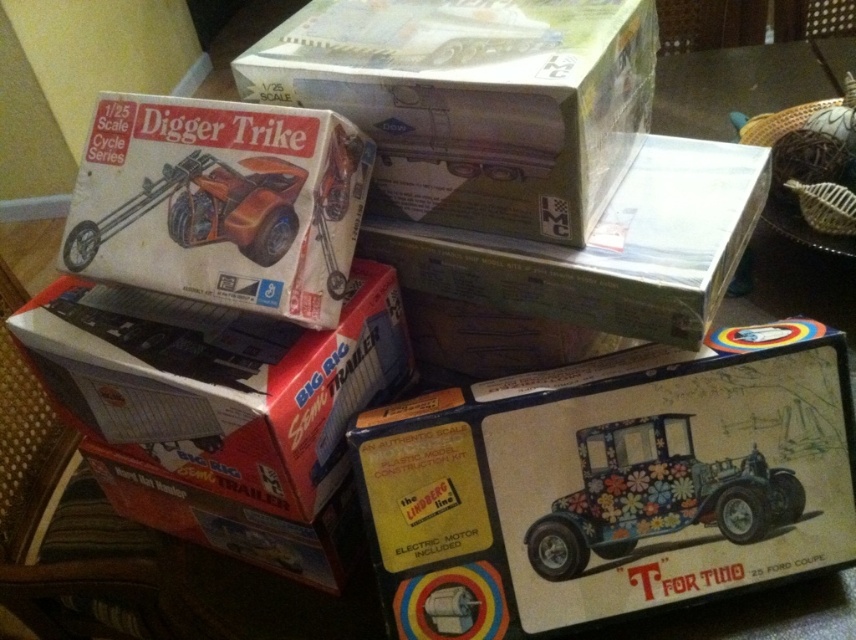
Does point (522, 556) come in front of point (449, 605)?

No, it is behind (449, 605).

Which is more to the right, floral-patterned plastic model kit at center or floral fabric car at lower right?

floral-patterned plastic model kit at center is more to the right.

Is point (605, 577) farther from viewer compared to point (480, 625)?

Yes, it is.

I want to click on floral-patterned plastic model kit at center, so click(610, 483).

Is floral-patterned plastic model kit at center positioned in front of white cardboard box at center?

No, it is not.

This screenshot has height=640, width=856. What do you see at coordinates (610, 483) in the screenshot?
I see `floral-patterned plastic model kit at center` at bounding box center [610, 483].

Is point (678, 522) behind point (302, 486)?

Yes, it is.

Image resolution: width=856 pixels, height=640 pixels. Identify the location of floral-patterned plastic model kit at center. (610, 483).

Can you confirm if matte cardboard box at upper center is positioned above metallic orange trike at upper left?

Yes, matte cardboard box at upper center is above metallic orange trike at upper left.

How distant is matte cardboard box at upper center from metallic orange trike at upper left?

→ They are 7.33 inches apart.

Is point (488, 3) less distant than point (272, 202)?

That is False.

The height and width of the screenshot is (640, 856). What are the coordinates of `matte cardboard box at upper center` in the screenshot? It's located at (474, 100).